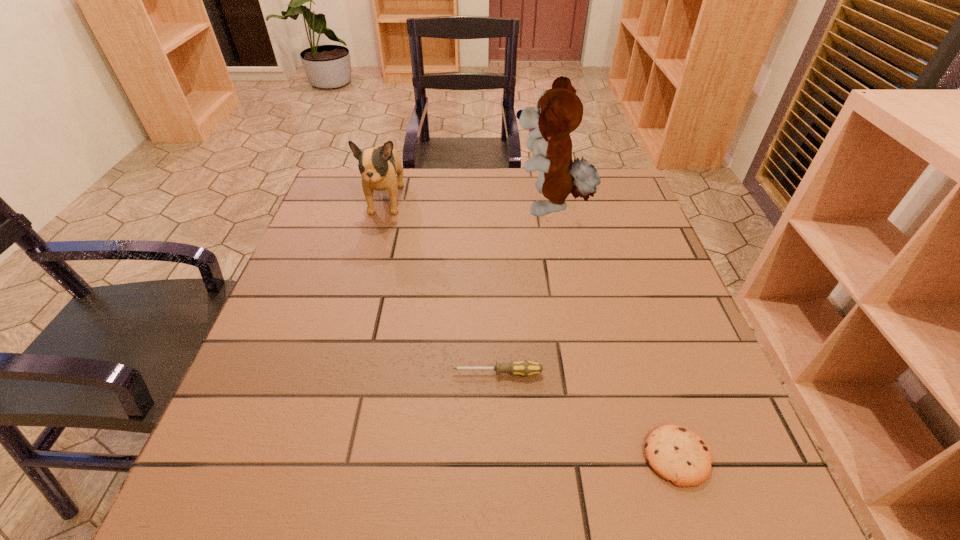
This screenshot has height=540, width=960. Find the location of `object at the near right corner`. object at the near right corner is located at coordinates (676, 454).

Locate an element on the screen. The image size is (960, 540). free space at the far edge of the desktop is located at coordinates (423, 201).

Locate an element on the screen. This screenshot has width=960, height=540. free space at the near edge of the desktop is located at coordinates (421, 503).

The width and height of the screenshot is (960, 540). I want to click on vacant space at the left edge, so click(224, 433).

Image resolution: width=960 pixels, height=540 pixels. In the image, there is a desktop. What are the coordinates of `vacant space at the right edge` in the screenshot? It's located at (665, 312).

The width and height of the screenshot is (960, 540). I want to click on free space at the far left corner of the desktop, so click(x=320, y=210).

This screenshot has width=960, height=540. Find the location of `free space between the right puppy and the cookie`. free space between the right puppy and the cookie is located at coordinates (613, 332).

Identify the location of vacant area that lies between the cookie and the screwdriver. (587, 415).

Locate an element on the screen. free spot between the cookie and the left puppy is located at coordinates (531, 328).

Locate an element on the screen. This screenshot has width=960, height=540. vacant region between the shorter puppy and the screwdriver is located at coordinates (442, 287).